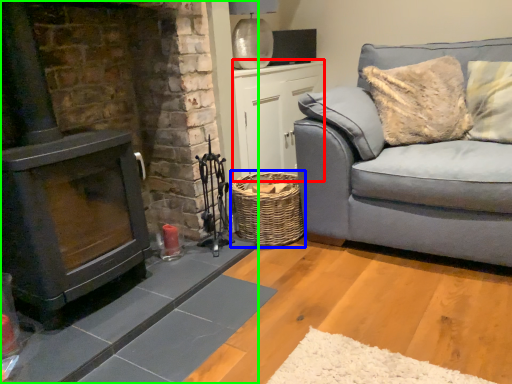
Question: Which object is the closest to the table (highlighted by a red box)? Choose among these: basket (highlighted by a blue box) or fireplace (highlighted by a green box).

Choices:
 (A) basket
 (B) fireplace

Answer: (A)